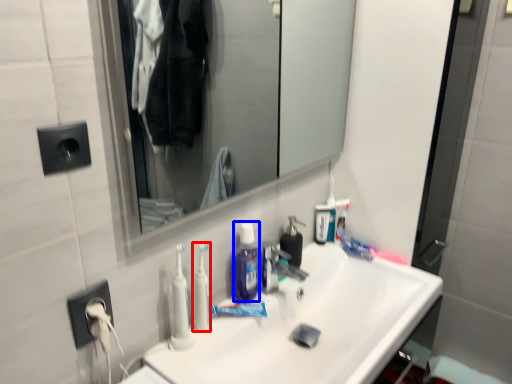
Question: Which point is closer to the camera, toothbrush (highlighted by a red box) or mouthwash (highlighted by a blue box)?

Choices:
 (A) toothbrush
 (B) mouthwash

Answer: (A)